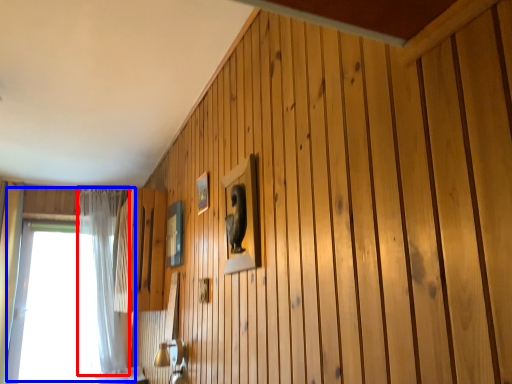
Question: Among these objects, which one is farthest to the camera, curtain (highlighted by a red box) or window (highlighted by a blue box)?

Choices:
 (A) curtain
 (B) window

Answer: (B)